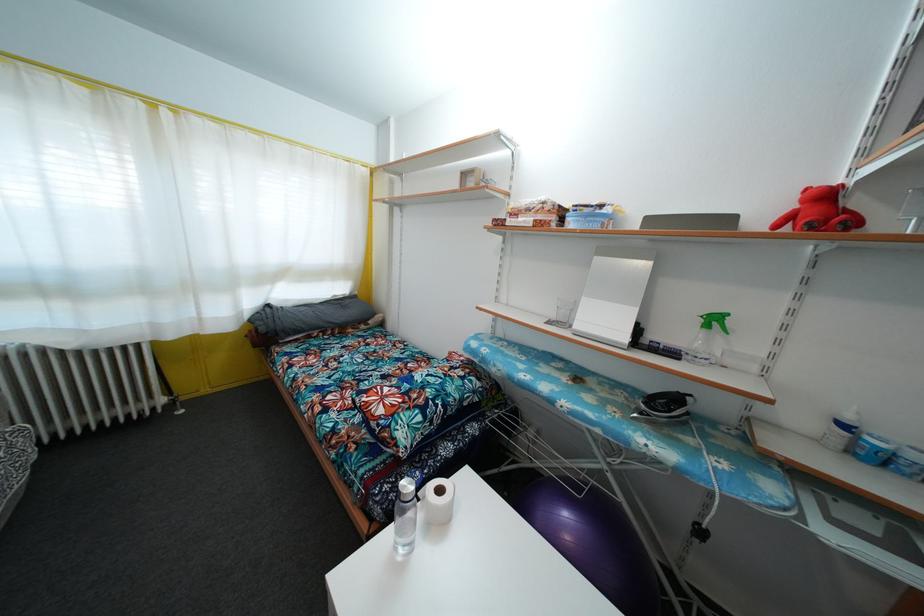
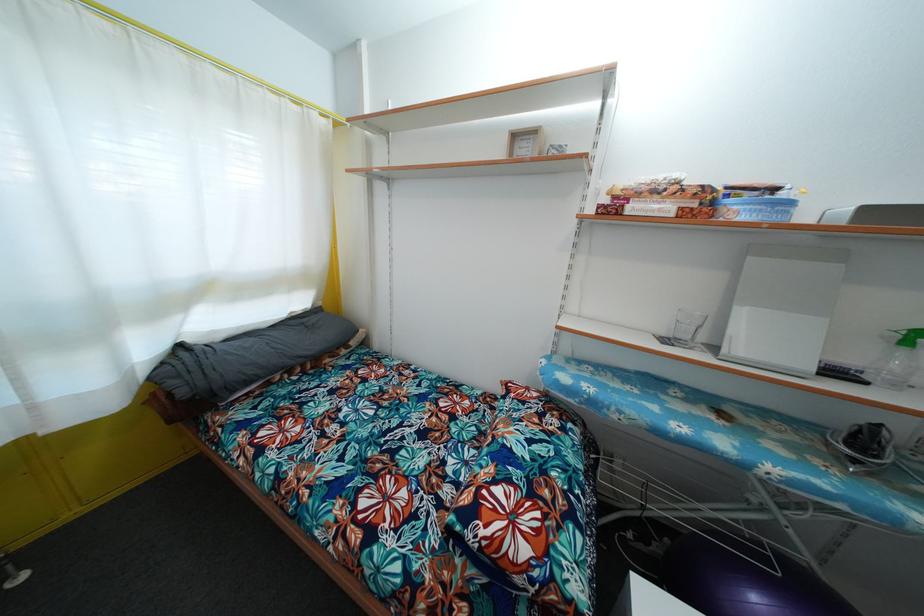
Where in the second image is the point corresponding to (265,336) from the first image?

(187, 399)